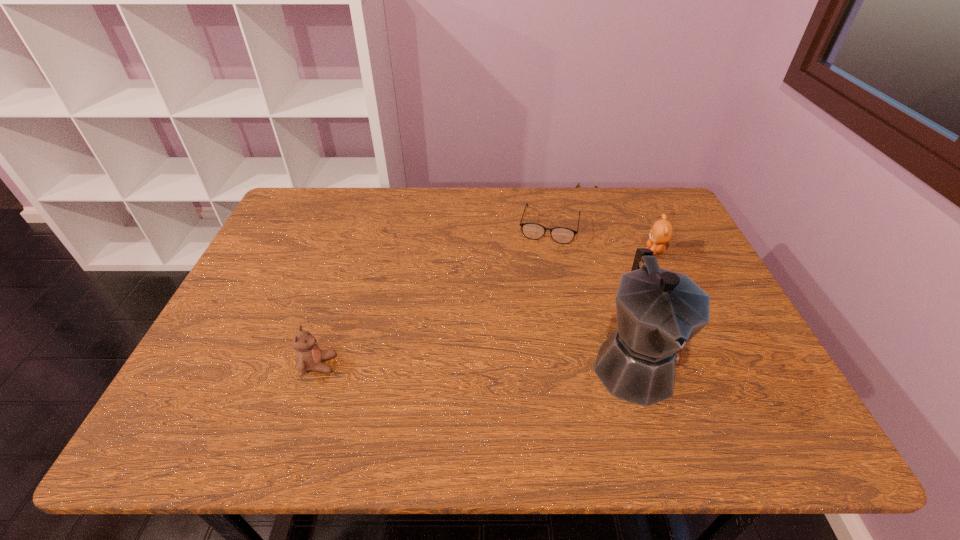
I want to click on the leftmost object, so click(x=309, y=357).

I want to click on the left teddy bear, so click(x=309, y=357).

I want to click on coffeepot, so click(x=659, y=311).

Image resolution: width=960 pixels, height=540 pixels. What are the coordinates of `spectacles` in the screenshot? It's located at (562, 235).

At what (x,y) coordinates should I click in order to perform the action: click on the farther teddy bear. Please return your answer as a coordinate pair (x, y). This screenshot has height=540, width=960. Looking at the image, I should click on (661, 232).

This screenshot has width=960, height=540. What are the coordinates of `the right teddy bear` in the screenshot? It's located at (661, 232).

At what (x,y) coordinates should I click in order to perform the action: click on free point located 0.150m on the front-facing side of the left teddy bear. Please return your answer as a coordinate pair (x, y). This screenshot has height=540, width=960. Looking at the image, I should click on (402, 364).

Find the location of a particular element. This screenshot has height=540, width=960. vacant space situated 0.350m on the front-facing side of the shortest object is located at coordinates (526, 336).

Identify the location of free space located 0.280m on the front-facing side of the shortest object. This screenshot has height=540, width=960. (531, 315).

You are a GUI agent. You are given a task and a screenshot of the screen. Output one action in this format:
    pyautogui.click(x=<x>, y=<y>)
    Task: Click on the free space located on the front-facing side of the shortest object
    
    Given the screenshot: What is the action you would take?
    pyautogui.click(x=537, y=290)